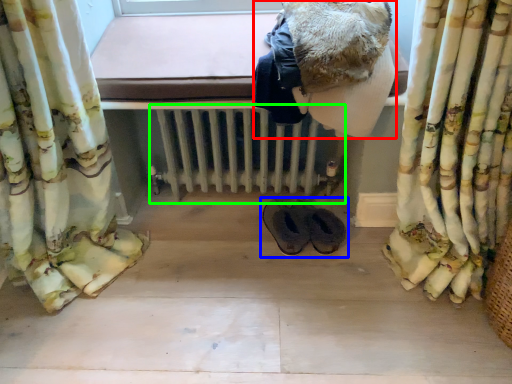
Question: Which object is the farthest from clothing (highlighted by a red box)? Choose among these: footwear (highlighted by a blue box) or radiator (highlighted by a green box).

Choices:
 (A) footwear
 (B) radiator

Answer: (A)